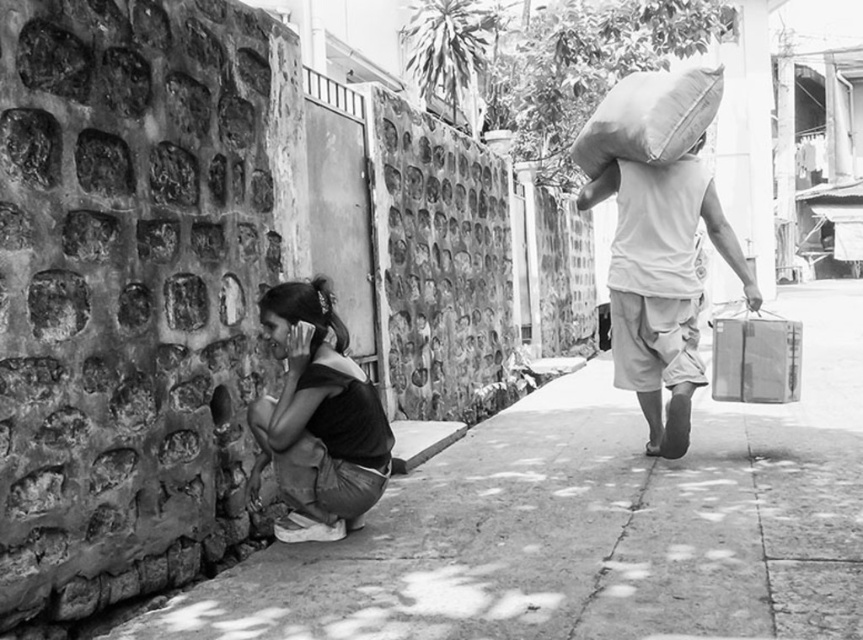
Does dark fabric shirt at lower left have a lesser height compared to metallic gray suitcase at right?

No.

Between dark fabric shirt at lower left and metallic gray suitcase at right, which one has less height?

metallic gray suitcase at right

Locate an element on the screen. The image size is (863, 640). dark fabric shirt at lower left is located at coordinates (317, 419).

In the scene shown: Is matte white shirt at right closer to the viewer compared to textured brown sack at upper right?

No, it is not.

Which is below, matte white shirt at right or textured brown sack at upper right?

matte white shirt at right is below.

Identify the location of matte white shirt at right. (660, 284).

Looking at this image, which of these two, smooth concrete pavement at lower left or metallic gray suitcase at right, stands taller?

metallic gray suitcase at right is taller.

Who is more forward, (x=249, y=580) or (x=794, y=394)?

Point (x=249, y=580)

Identify the location of smooth concrete pavement at lower left. (591, 524).